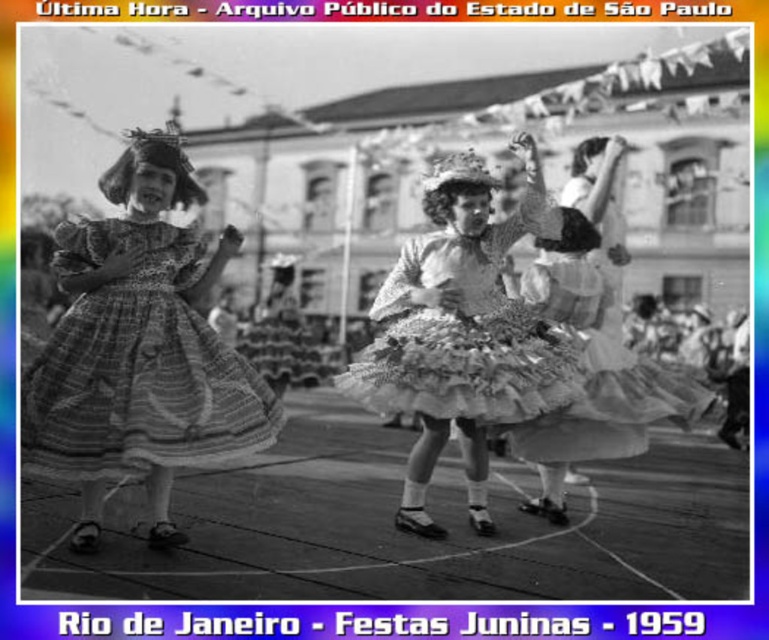
Question: Which object appears farthest from the camera in this image?

Choices:
 (A) white lace dress at center
 (B) textured cotton dress at left
 (C) ruffled fabric dress at center

Answer: (A)

Question: Based on their relative distances, which object is farther from the textured cotton dress at left?

Choices:
 (A) ruffled fabric dress at center
 (B) white lace dress at center

Answer: (B)

Question: Is textured cotton dress at left in front of ruffled fabric dress at center?

Choices:
 (A) yes
 (B) no

Answer: (A)

Question: Is textured cotton dress at left behind white lace dress at center?

Choices:
 (A) no
 (B) yes

Answer: (A)

Question: Which point is farther from the camera taking this photo?

Choices:
 (A) coord(598,232)
 (B) coord(383,352)

Answer: (A)

Question: Can you confirm if ruffled fabric dress at center is positioned to the right of white lace dress at center?

Choices:
 (A) yes
 (B) no

Answer: (B)